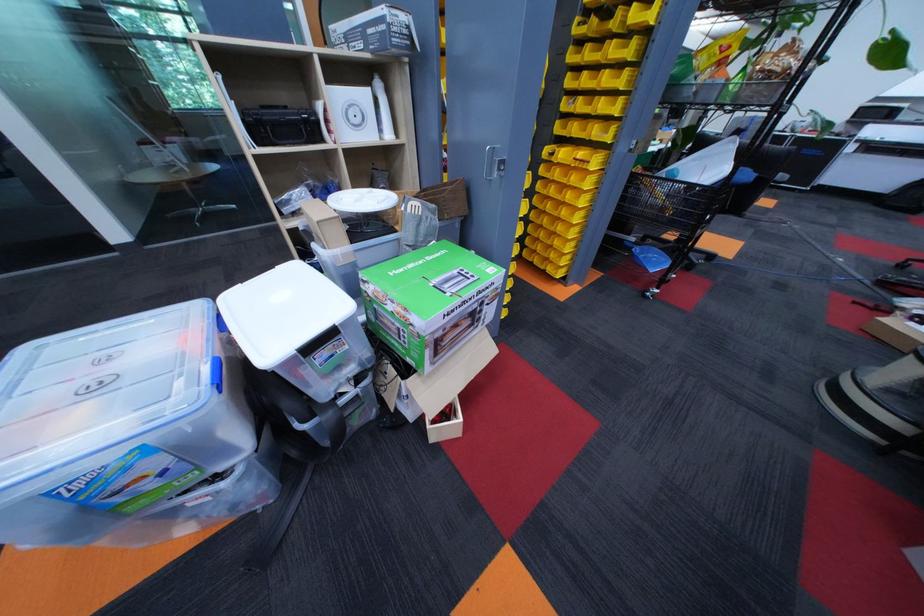
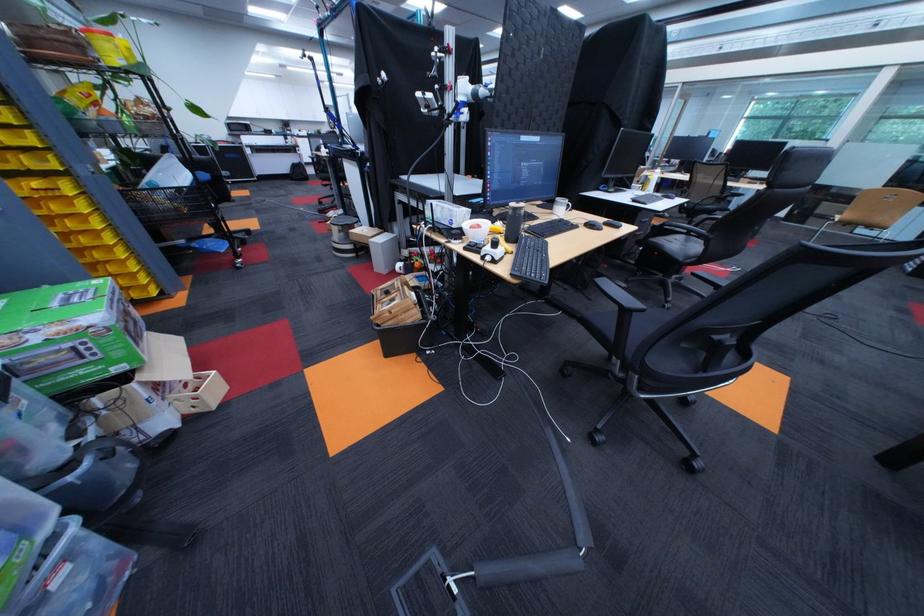
Where in the second image is the point corresponding to (x=459, y=286) from the first image?

(89, 302)